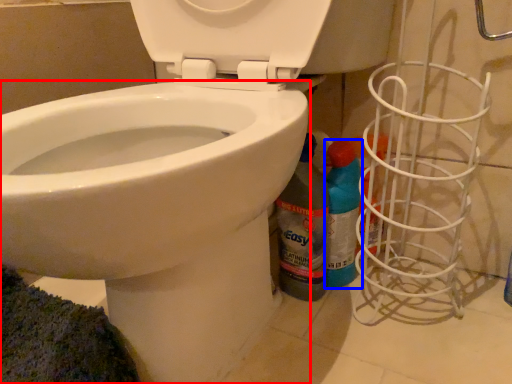
Question: Among these objects, which one is farthest to the camera, bidet (highlighted by a red box) or cleaning product (highlighted by a blue box)?

Choices:
 (A) bidet
 (B) cleaning product

Answer: (B)